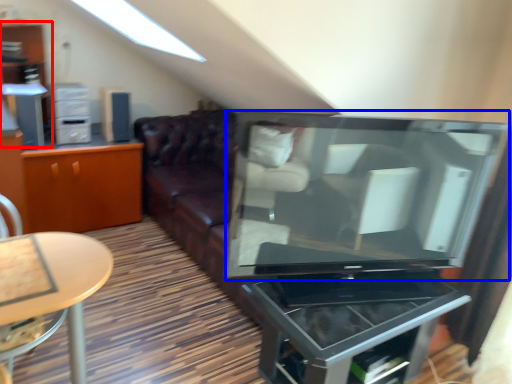
Question: Which object appears closest to the camera in this image, dresser (highlighted by a red box) or television (highlighted by a blue box)?

Choices:
 (A) dresser
 (B) television

Answer: (B)